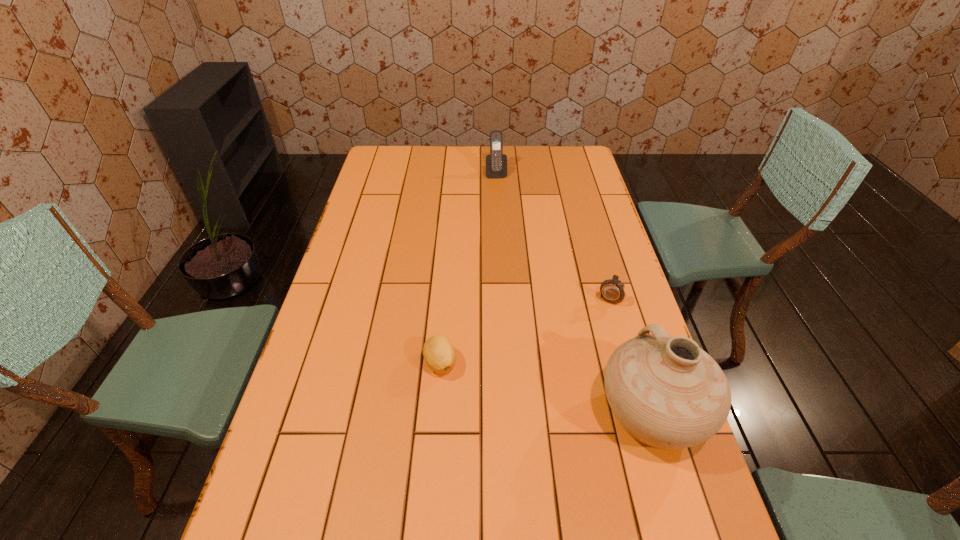
Identify which object is the second nearest to the leftmost object. Please provide its 2D coordinates. Your answer should be formatted as a tuple, i.e. [(x, y)], where the tuple contains the x and y coordinates of a point satisfying the conditions above.

[(612, 291)]

This screenshot has width=960, height=540. In order to click on free spot that satisfies the following two spatial constraints: 1. on the front side of the second tallest object; 2. on the right side of the second farthest object in this screenshot , I will do `click(502, 294)`.

Locate an element on the screen. The width and height of the screenshot is (960, 540). vacant area in the image that satisfies the following two spatial constraints: 1. on the front side of the third object from right to left; 2. on the right side of the third tallest object is located at coordinates (502, 294).